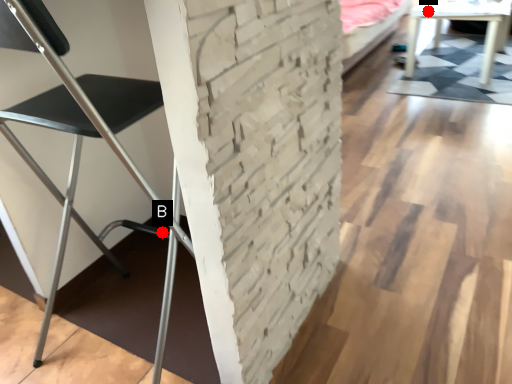
Question: Two points are circled on the image, labeled by A and B beside each circle. Which point is closer to the camera taking this photo?

Choices:
 (A) A is closer
 (B) B is closer

Answer: (B)